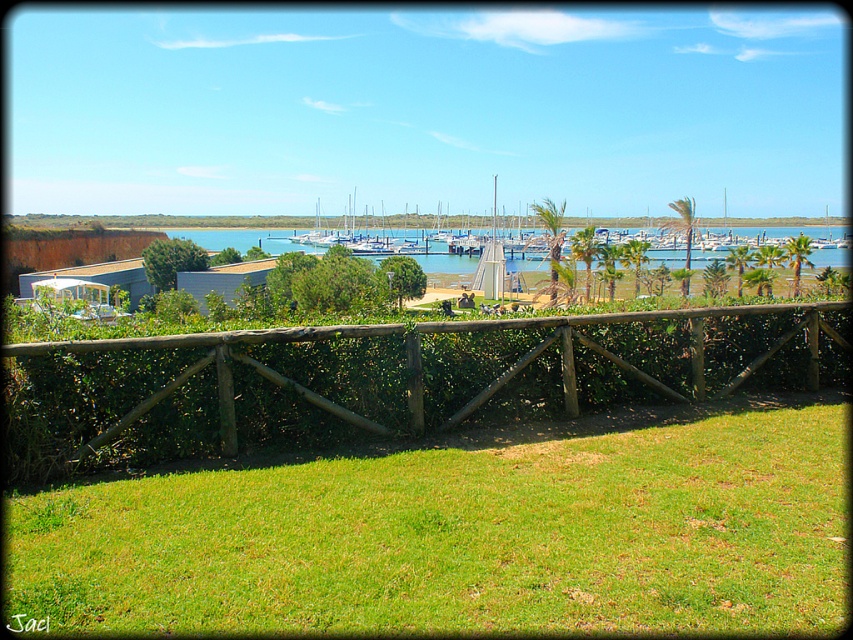
Question: Is brown wooden fence at center to the left of green leafy hedge at center from the viewer's perspective?

Choices:
 (A) yes
 (B) no

Answer: (B)

Question: Which of the following is the farthest from the observer?

Choices:
 (A) (193, 444)
 (B) (397, 486)
 (C) (151, 250)

Answer: (C)

Question: Which point appears closest to the camera in this image?

Choices:
 (A) (178, 445)
 (B) (198, 257)
 (C) (167, 604)

Answer: (C)

Question: Is green grass at lower center wider than green leafy hedge at center?

Choices:
 (A) yes
 (B) no

Answer: (A)

Question: Which object is closer to the camera taking this photo?

Choices:
 (A) green leafy hedge at center
 (B) brown wooden fence at center

Answer: (B)

Question: Can you confirm if brown wooden fence at center is wider than green leafy hedge at center?

Choices:
 (A) yes
 (B) no

Answer: (B)